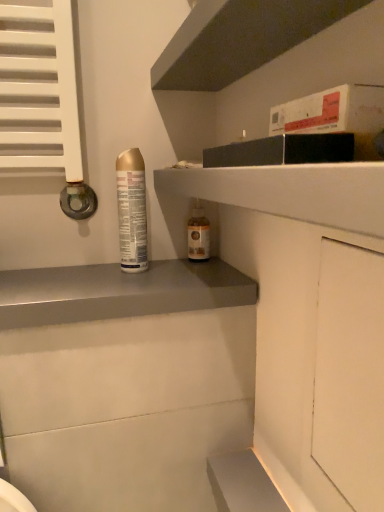
Question: Does white matte cabinet at right touch gold metallic can at left, which is the second bottle in back-to-front order?

Choices:
 (A) yes
 (B) no

Answer: (B)

Question: From the image's perspective, is white matte cabinet at right located above gold metallic can at left, positioned as the 2th bottle in right-to-left order?

Choices:
 (A) no
 (B) yes

Answer: (A)

Question: From the image's perspective, is white matte cabinet at right located beneath gold metallic can at left, the 1th bottle viewed from the left?

Choices:
 (A) no
 (B) yes

Answer: (B)

Question: Considering the relative sizes of white matte cabinet at right and gold metallic can at left, positioned as the 2th bottle in right-to-left order, in the image provided, is white matte cabinet at right bigger than gold metallic can at left, positioned as the 2th bottle in right-to-left order,?

Choices:
 (A) no
 (B) yes

Answer: (B)

Question: Is white matte cabinet at right at the left side of gold metallic can at left, the 1th bottle viewed from the left?

Choices:
 (A) no
 (B) yes

Answer: (A)

Question: From the image's perspective, relative to smooth gray shelf at center, placed as the first shelf when sorted from bottom to top, is white matte cabinet at right above or below?

Choices:
 (A) below
 (B) above

Answer: (A)

Question: Does point (324, 365) appear closer or farther from the camera than point (119, 294)?

Choices:
 (A) farther
 (B) closer

Answer: (B)

Question: From a real-world perspective, is white matte cabinet at right above or below smooth gray shelf at center, placed as the first shelf when sorted from bottom to top?

Choices:
 (A) below
 (B) above

Answer: (A)

Question: Considering the positions of white matte cabinet at right and smooth gray shelf at center, placed as the first shelf when sorted from bottom to top, in the image, is white matte cabinet at right taller or shorter than smooth gray shelf at center, placed as the first shelf when sorted from bottom to top,?

Choices:
 (A) tall
 (B) short

Answer: (A)

Question: From the image's perspective, is translucent glass bottle at center, which is the second bottle from left to right, located above or below smooth gray shelf at center, which ranks as the 3th shelf in top-to-bottom order?

Choices:
 (A) above
 (B) below

Answer: (A)

Question: Which is correct: translucent glass bottle at center, which is the second bottle from left to right, is inside smooth gray shelf at center, placed as the first shelf when sorted from bottom to top, or outside of it?

Choices:
 (A) inside
 (B) outside

Answer: (B)

Question: Considering the positions of point (190, 241) and point (28, 269), is point (190, 241) closer or farther from the camera than point (28, 269)?

Choices:
 (A) closer
 (B) farther

Answer: (B)

Question: In terms of width, does translucent glass bottle at center, the 1th bottle when ordered from back to front, look wider or thinner when compared to smooth gray shelf at center, which ranks as the 3th shelf in top-to-bottom order?

Choices:
 (A) thin
 (B) wide

Answer: (A)

Question: Is point (244, 303) positioned closer to the camera than point (205, 248)?

Choices:
 (A) farther
 (B) closer

Answer: (B)

Question: Is smooth gray shelf at center, which ranks as the 3th shelf in top-to-bottom order, taller or shorter than translucent glass bottle at center, which is the first bottle from right to left?

Choices:
 (A) short
 (B) tall

Answer: (A)